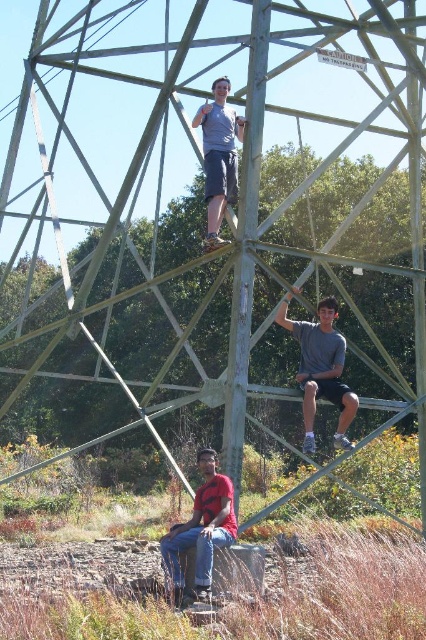
Question: Among these points, which one is farthest from the camera?

Choices:
 (A) (195, 564)
 (B) (222, 140)

Answer: (B)

Question: Can you confirm if matte gray shirt at center is smaller than matte gray shirt at upper center?

Choices:
 (A) yes
 (B) no

Answer: (A)

Question: Which point is farther to the camera?

Choices:
 (A) (175, 598)
 (B) (342, 362)
 (C) (242, 120)

Answer: (B)

Question: Is matte gray shirt at center wider than matte gray shirt at upper center?

Choices:
 (A) no
 (B) yes

Answer: (B)

Question: Does red shirt at lower center appear under matte gray shirt at upper center?

Choices:
 (A) yes
 (B) no

Answer: (A)

Question: Which of the following is the farthest from the observer?

Choices:
 (A) red shirt at lower center
 (B) matte gray shirt at upper center
 (C) matte gray shirt at center

Answer: (C)